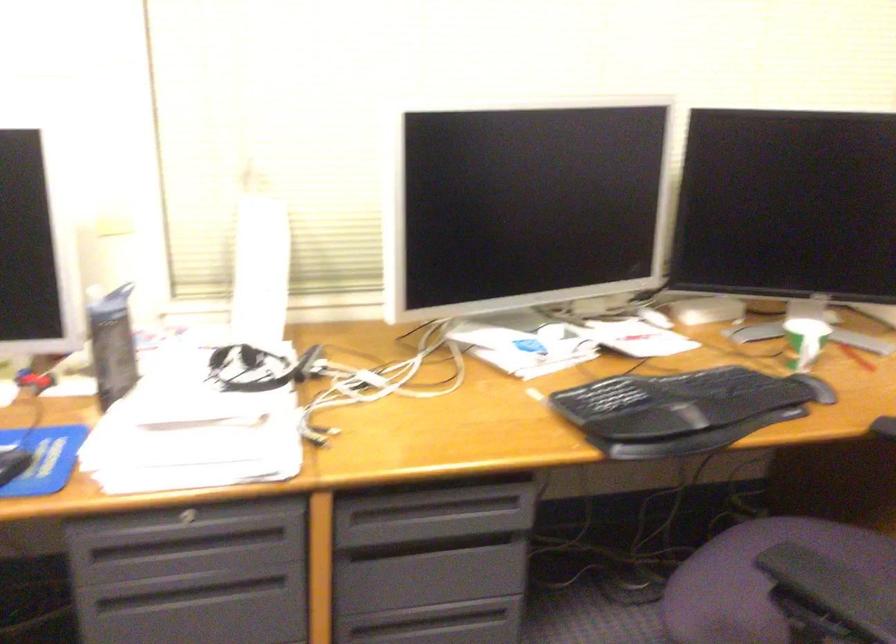
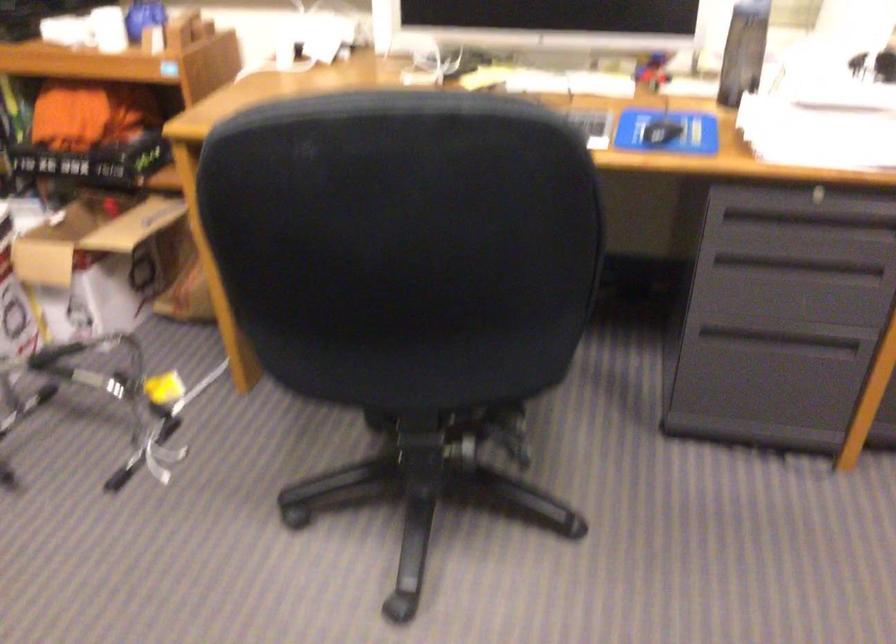
The point at (192, 527) is marked in the first image. Where is the corresponding point in the second image?

(817, 196)